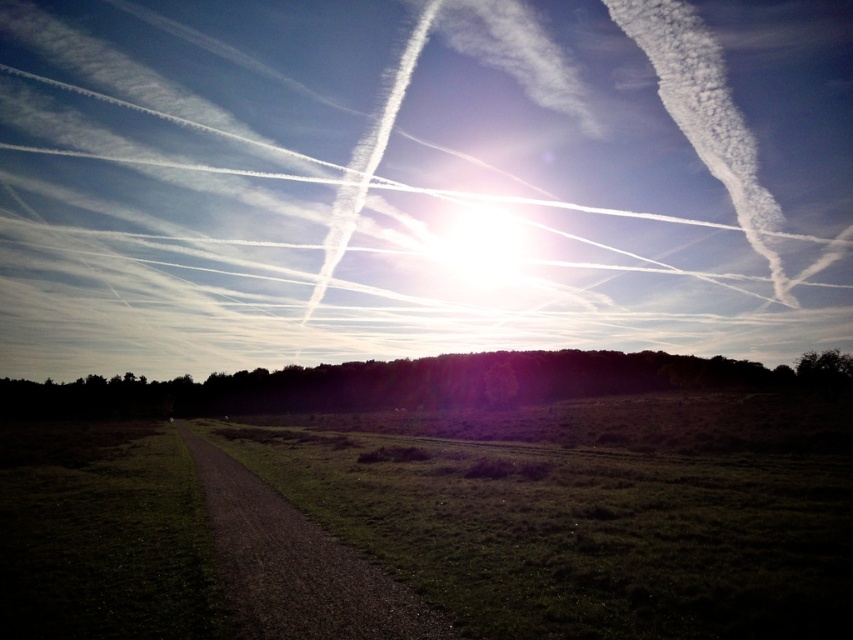
Question: Does green grassy field at lower center have a smaller size compared to dirt/gravel path at lower left?

Choices:
 (A) yes
 (B) no

Answer: (B)

Question: Which of the following is the closest to the observer?

Choices:
 (A) (360, 596)
 (B) (618, 476)

Answer: (A)

Question: Among these points, which one is farthest from the camera?

Choices:
 (A) (346, 628)
 (B) (833, 595)

Answer: (A)

Question: Which of the following is the farthest from the observer?

Choices:
 (A) (202, 476)
 (B) (668, 529)

Answer: (A)

Question: Is green grassy field at lower center positioned before dirt/gravel path at lower left?

Choices:
 (A) yes
 (B) no

Answer: (A)

Question: From the image, what is the correct spatial relationship of green grassy field at lower center in relation to dirt/gravel path at lower left?

Choices:
 (A) left
 (B) right

Answer: (B)